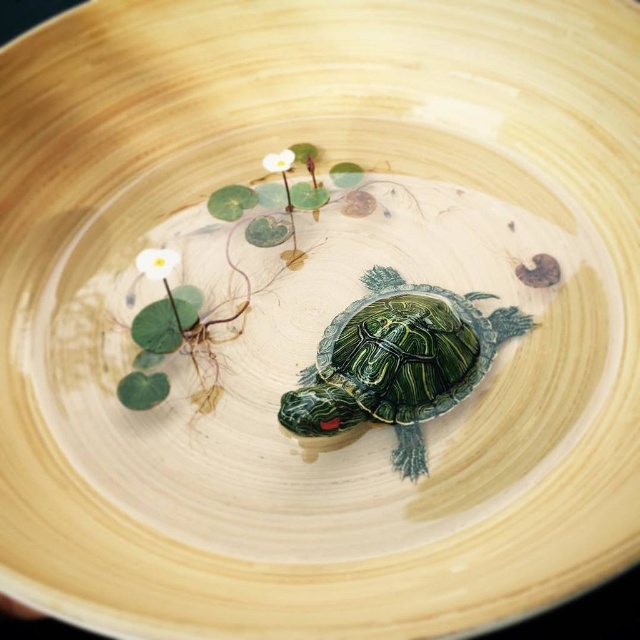
Which is below, green leafy plant at center or white matte flower at upper left?

green leafy plant at center

Who is positioned more to the right, green leafy plant at center or white matte flower at upper left?

Positioned to the right is green leafy plant at center.

Which is in front, point (284, 186) or point (164, 266)?

Positioned in front is point (164, 266).

Where is `green leafy plant at center`? green leafy plant at center is located at coordinates (182, 317).

Who is more distant from viewer, (288, 417) or (275, 164)?

The point (275, 164) is behind.

Locate an element on the screen. This screenshot has width=640, height=640. shiny green tortoise at center is located at coordinates (397, 362).

Can you confirm if shiny green tortoise at center is taller than green leafy plant at center?

Incorrect, shiny green tortoise at center's height is not larger of green leafy plant at center's.

Which is more to the left, shiny green tortoise at center or green leafy plant at center?

green leafy plant at center

Identify the location of shiny green tortoise at center. (397, 362).